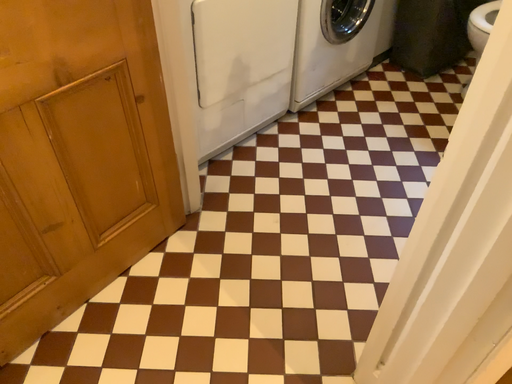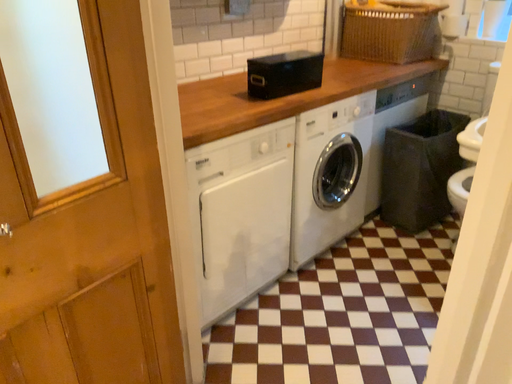
Question: How did the camera likely rotate when shooting the video?

Choices:
 (A) rotated upward
 (B) rotated downward

Answer: (A)